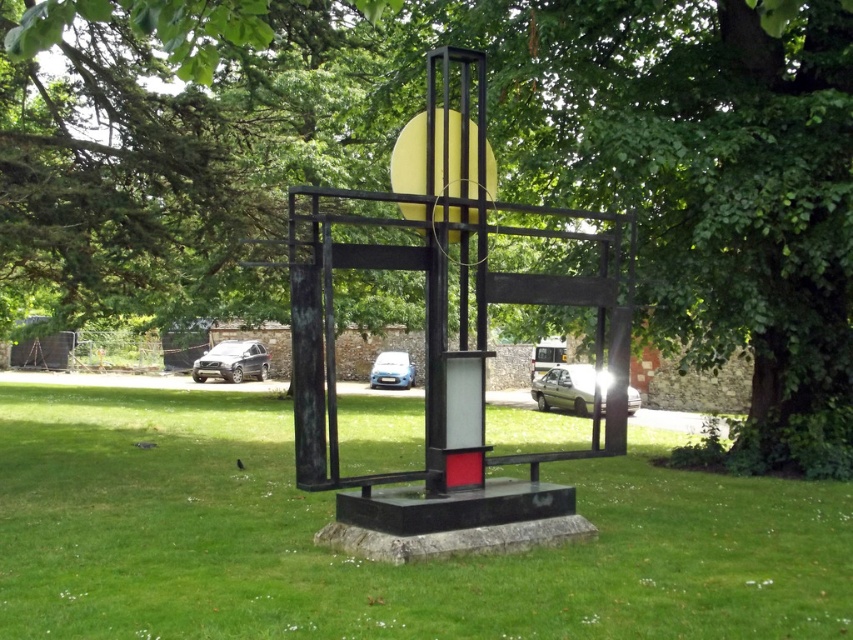
Question: Is green leafy tree at center above green grass at center?

Choices:
 (A) no
 (B) yes

Answer: (B)

Question: Does green leafy tree at center appear on the left side of green grass at center?

Choices:
 (A) yes
 (B) no

Answer: (A)

Question: Which object is closer to the camera taking this photo?

Choices:
 (A) green leafy tree at center
 (B) green grass at center

Answer: (A)

Question: Is green leafy tree at center below green grass at center?

Choices:
 (A) yes
 (B) no

Answer: (B)